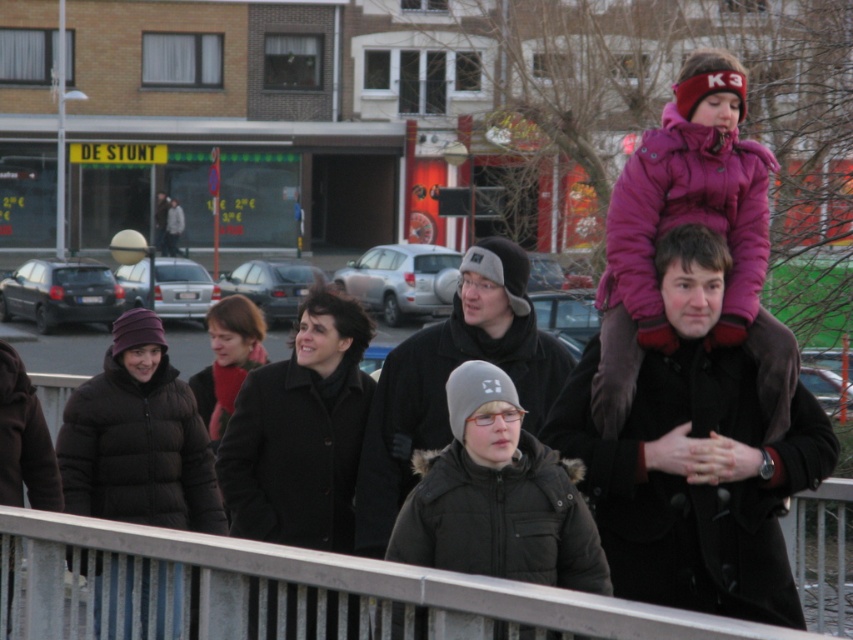
You are standing at the point labeled point (51,518) and want to reach the viewer who is 24.20 feet away. If your walking speed is 3 feet per second, how many seconds will it take you to reach the viewer?

The distance between point (51,518) and the viewer is 24.20 feet. At a walking speed of 3 feet per second, it will take 24.20 divided by 3, which equals approximately 8.07 seconds to reach the viewer.

You are a delivery robot with a width of 1.2 meters. You need to pass between the dark brown coat at center and the black puffy coat at lower left. Can you fit through the space between them?

The distance between the dark brown coat at center and the black puffy coat at lower left is 3.74 meters. Since your width is 1.2 meters, you can easily fit through the space as it is wider than your size.